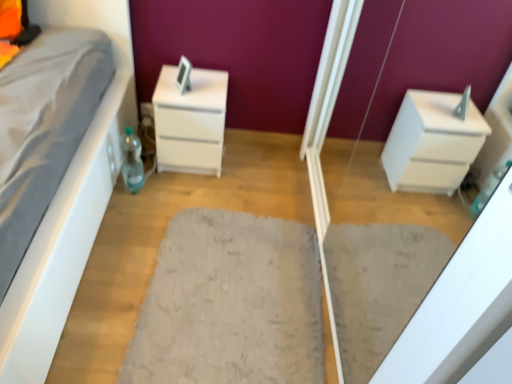
Locate an element on the screen. unoccupied region to the right of translucent plastic bottle at lower left is located at coordinates (167, 193).